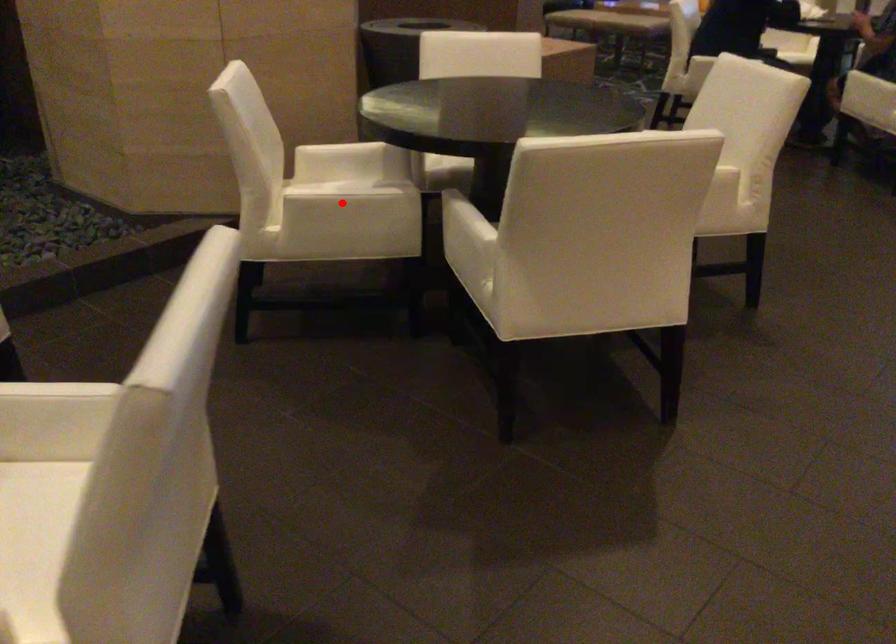
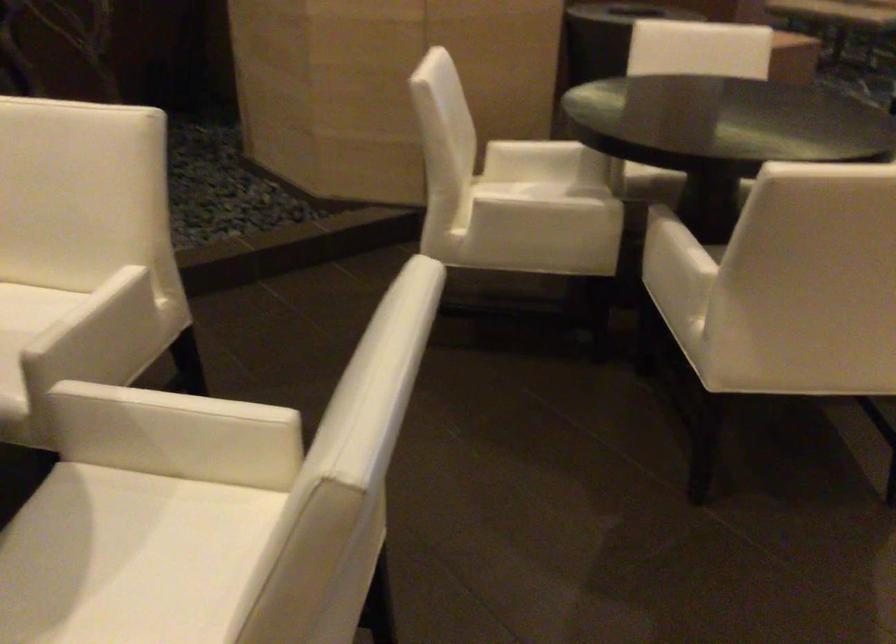
In the second image, find the point that corresponds to the highlighted location in the first image.

(540, 212)